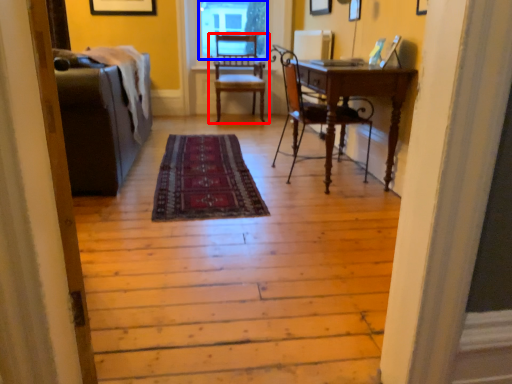
Question: Which of the following is the closest to the observer, chair (highlighted by a red box) or window screen (highlighted by a blue box)?

Choices:
 (A) chair
 (B) window screen

Answer: (A)